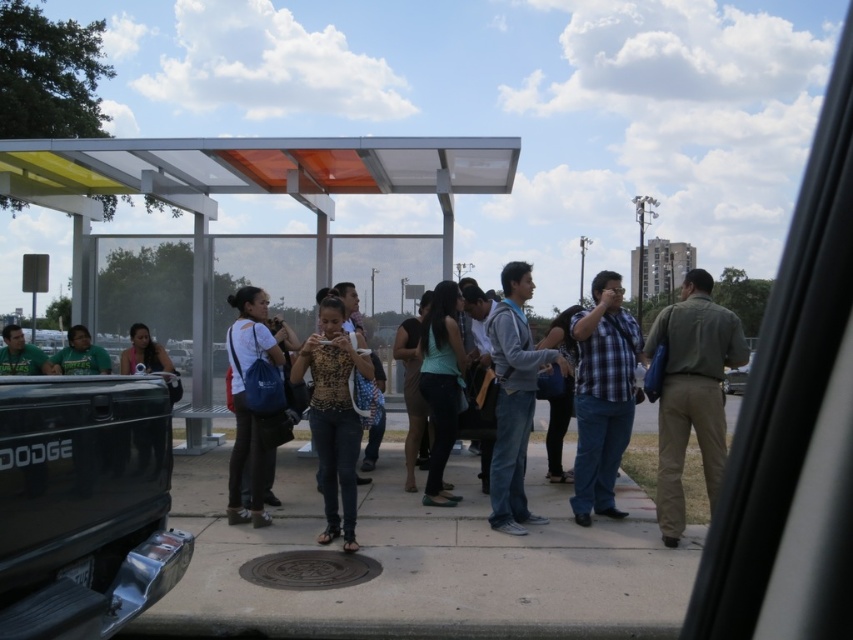
Question: Is translucent plastic bus stop at center bigger than green fabric shirt at left?

Choices:
 (A) no
 (B) yes

Answer: (A)

Question: Which of the following is the closest to the observer?

Choices:
 (A) green fabric shirt at left
 (B) teal fabric shirt at center
 (C) matte black shirt at center

Answer: (B)

Question: In this image, where is translucent plastic bus stop at center located relative to teal fabric shirt at center?

Choices:
 (A) left
 (B) right

Answer: (A)

Question: Does matte black truck at right appear on the left side of green cotton shirt at right?

Choices:
 (A) no
 (B) yes

Answer: (A)

Question: Which point is farther from the camera taking this photo?

Choices:
 (A) (341, 378)
 (B) (62, 358)

Answer: (B)

Question: Estimate the real-world distances between objects in this image. Which object is closer to the leopard print top at center?

Choices:
 (A) teal fabric shirt at center
 (B) matte black truck at right
 (C) translucent plastic bus stop at center
 (D) black matte truck bed at lower left

Answer: (A)